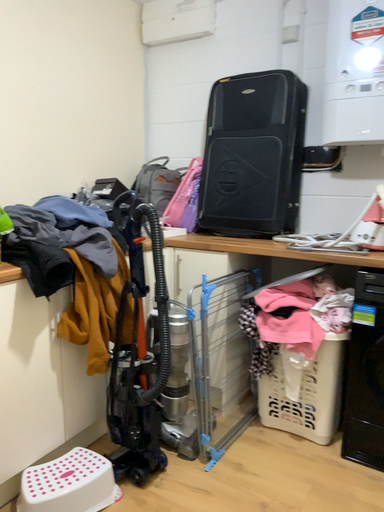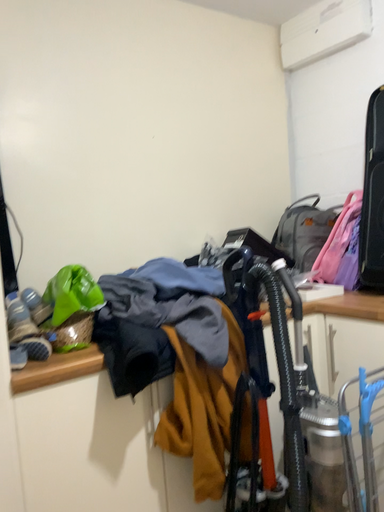
Question: Which way did the camera rotate in the video?

Choices:
 (A) rotated left
 (B) rotated right

Answer: (A)